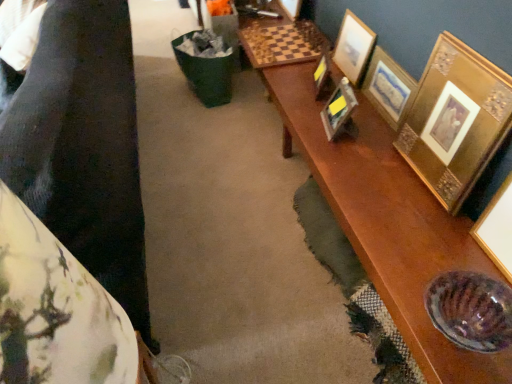
Question: Are gold textured picture frame at upper right, which is the 2th picture frame from right to left, and fluffy fabric cushion at left far apart?

Choices:
 (A) yes
 (B) no

Answer: (A)

Question: Can you confirm if gold textured picture frame at upper right, which is the 2th picture frame from right to left, is wider than fluffy fabric cushion at left?

Choices:
 (A) no
 (B) yes

Answer: (A)

Question: Does gold textured picture frame at upper right, which is the 2th picture frame from right to left, come in front of fluffy fabric cushion at left?

Choices:
 (A) no
 (B) yes

Answer: (A)

Question: Is fluffy fabric cushion at left surrounded by gold textured picture frame at upper right, which is the 2th picture frame from right to left?

Choices:
 (A) yes
 (B) no

Answer: (B)

Question: Does gold textured picture frame at upper right, placed as the 4th picture frame when sorted from left to right, have a smaller size compared to fluffy fabric cushion at left?

Choices:
 (A) no
 (B) yes

Answer: (B)

Question: From the image's perspective, is gold metallic picture frame at upper right, which ranks as the fifth picture frame in right-to-left order, located above or below gold textured frame at upper right, positioned as the third picture frame in left-to-right order?

Choices:
 (A) below
 (B) above

Answer: (A)

Question: Visually, is gold metallic picture frame at upper right, the 1th picture frame from the left, positioned to the left or to the right of gold textured frame at upper right, positioned as the third picture frame in left-to-right order?

Choices:
 (A) right
 (B) left

Answer: (B)

Question: Considering the positions of gold metallic picture frame at upper right, the 1th picture frame from the left, and gold textured frame at upper right, acting as the third picture frame starting from the right, in the image, is gold metallic picture frame at upper right, the 1th picture frame from the left, wider or thinner than gold textured frame at upper right, acting as the third picture frame starting from the right,?

Choices:
 (A) wide
 (B) thin

Answer: (A)

Question: Does point (x=326, y=89) appear closer or farther from the camera than point (x=345, y=24)?

Choices:
 (A) farther
 (B) closer

Answer: (B)

Question: From a real-world perspective, is gold ornate picture frame at right, which appears as the 1th picture frame when viewed from the right, positioned above or below metallic gold picture frame at center, acting as the 4th picture frame starting from the right?

Choices:
 (A) above
 (B) below

Answer: (A)

Question: Do you think gold ornate picture frame at right, the fifth picture frame positioned from the left, is within metallic gold picture frame at center, which is the second picture frame from left to right, or outside of it?

Choices:
 (A) outside
 (B) inside

Answer: (A)

Question: In terms of height, does gold ornate picture frame at right, the fifth picture frame positioned from the left, look taller or shorter compared to metallic gold picture frame at center, which is the second picture frame from left to right?

Choices:
 (A) tall
 (B) short

Answer: (A)

Question: From the image's perspective, is gold ornate picture frame at right, which appears as the 1th picture frame when viewed from the right, above or below metallic gold picture frame at center, which is the second picture frame from left to right?

Choices:
 (A) below
 (B) above

Answer: (A)

Question: Considering their positions, is gold textured frame at upper right, acting as the third picture frame starting from the right, located in front of or behind gold ornate picture frame at right, which appears as the 1th picture frame when viewed from the right?

Choices:
 (A) behind
 (B) front

Answer: (A)

Question: Is gold textured frame at upper right, acting as the third picture frame starting from the right, inside the boundaries of gold ornate picture frame at right, the fifth picture frame positioned from the left, or outside?

Choices:
 (A) inside
 (B) outside

Answer: (B)